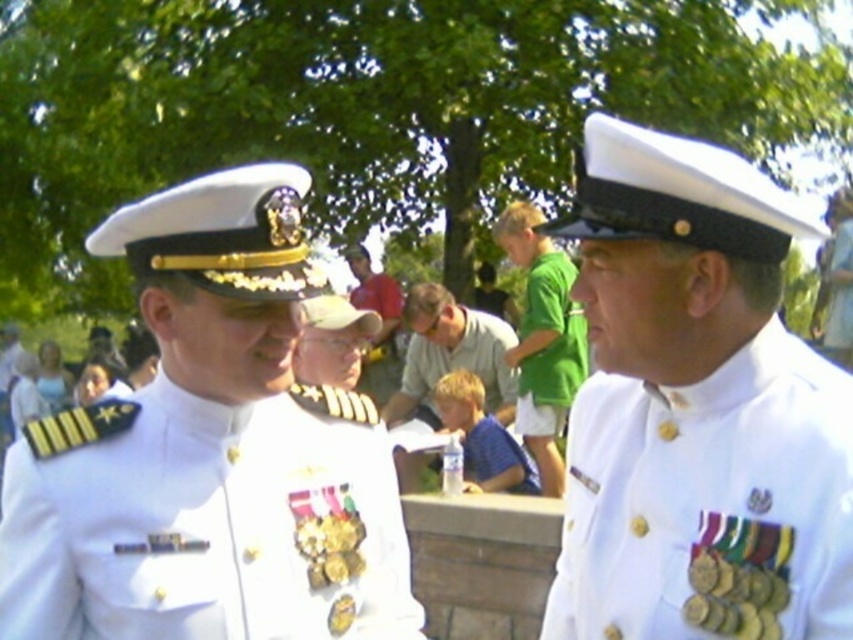
Can you confirm if white glossy uniform at center is positioned above green cotton shirt at center?

Actually, white glossy uniform at center is below green cotton shirt at center.

Where is `white glossy uniform at center`? white glossy uniform at center is located at coordinates click(207, 529).

Who is taller, white glossy uniform at center or green cotton shirt at upper center?

green cotton shirt at upper center is taller.

Does white glossy uniform at center have a lesser width compared to green cotton shirt at upper center?

No, white glossy uniform at center is not thinner than green cotton shirt at upper center.

Is point (148, 481) positioned after point (541, 406)?

That is False.

Image resolution: width=853 pixels, height=640 pixels. Identify the location of white glossy uniform at center. (207, 529).

Who is higher up, white glossy uniform at center or white matte uniform at right?

Positioned higher is white matte uniform at right.

Does white glossy uniform at center lie behind white matte uniform at right?

Yes, white glossy uniform at center is behind white matte uniform at right.

Does point (169, 573) lie behind point (624, 564)?

Yes, it is behind point (624, 564).

In order to click on white glossy uniform at center in this screenshot , I will do `click(207, 529)`.